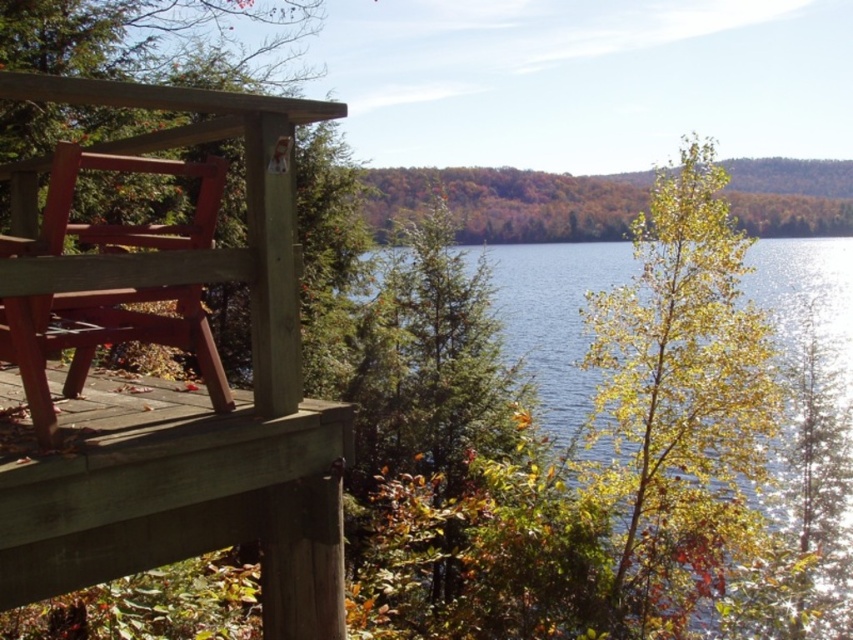
Question: Among these points, which one is farthest from the camera?

Choices:
 (A) (112, 321)
 (B) (73, 580)

Answer: (A)

Question: Is the position of wooden bench at left more distant than that of wooden deck at lower left?

Choices:
 (A) no
 (B) yes

Answer: (A)

Question: Which of the following is the closest to the observer?

Choices:
 (A) (318, 602)
 (B) (38, 477)

Answer: (B)

Question: Which object is farther from the camera taking this photo?

Choices:
 (A) matte red park bench at left
 (B) wooden bench at left

Answer: (A)

Question: Can you confirm if wooden bench at left is thinner than wooden deck at lower left?

Choices:
 (A) yes
 (B) no

Answer: (A)

Question: Is wooden bench at left further to the viewer compared to wooden deck at lower left?

Choices:
 (A) yes
 (B) no

Answer: (B)